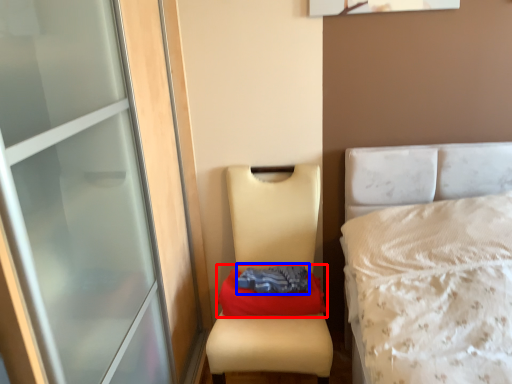
Question: Which object appears closest to the camera in this image, material (highlighted by a red box) or clothing (highlighted by a blue box)?

Choices:
 (A) material
 (B) clothing

Answer: (B)